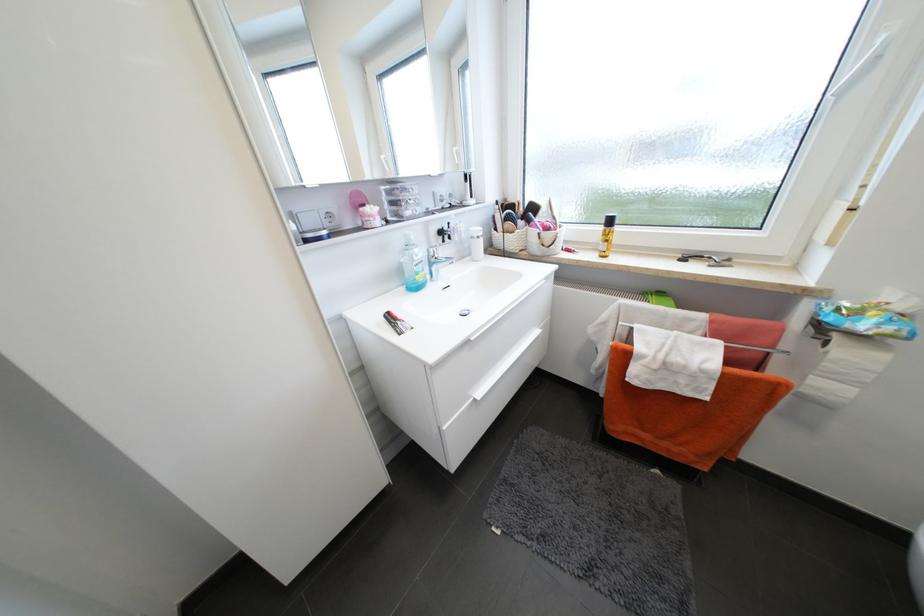
This screenshot has height=616, width=924. Find the location of `red and black tube`. red and black tube is located at coordinates (396, 323).